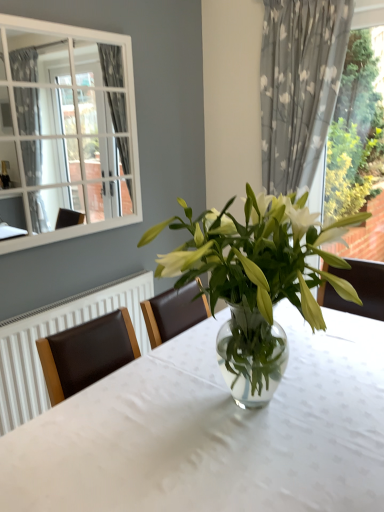
Locate an element on the screen. The image size is (384, 512). transparent glass vase at center is located at coordinates tap(214, 431).

The width and height of the screenshot is (384, 512). Describe the element at coordinates (299, 85) in the screenshot. I see `gray floral fabric curtain at right` at that location.

Locate an element on the screen. Image resolution: width=384 pixels, height=512 pixels. green leafy plant at right is located at coordinates (352, 128).

From the image's perspective, is green leafy plant at right above clear glass vase at center?

Yes.

Is green leafy plant at right oriented towards clear glass vase at center?

Yes, green leafy plant at right is aimed at clear glass vase at center.

Is green leafy plant at right smaller than clear glass vase at center?

Indeed, green leafy plant at right has a smaller size compared to clear glass vase at center.

Is green leafy plant at right positioned beyond the bounds of clear glass vase at center?

Yes, green leafy plant at right is not within clear glass vase at center.

Looking at the image, does clear glass vase at center seem bigger or smaller compared to gray floral fabric curtain at right?

Considering their sizes, clear glass vase at center takes up more space than gray floral fabric curtain at right.

From a real-world perspective, is clear glass vase at center above or below gray floral fabric curtain at right?

clear glass vase at center is situated lower than gray floral fabric curtain at right in the real world.

Image resolution: width=384 pixels, height=512 pixels. What are the coordinates of `table that appears below the gray floral fabric curtain at right (from a real-world perspective)` in the screenshot? It's located at (214, 431).

Is gray floral fabric curtain at right aimed at transparent glass vase at center?

Yes, gray floral fabric curtain at right faces towards transparent glass vase at center.

Would you say gray floral fabric curtain at right is outside transparent glass vase at center?

gray floral fabric curtain at right is positioned outside transparent glass vase at center.

Is green leafy plant at right directly adjacent to gray floral fabric curtain at right?

They are not placed beside each other.

Is green leafy plant at right looking in the opposite direction of gray floral fabric curtain at right?

green leafy plant at right does not have its back to gray floral fabric curtain at right.

Considering the positions of objects green leafy plant at right and gray floral fabric curtain at right in the image provided, who is more to the left, green leafy plant at right or gray floral fabric curtain at right?

gray floral fabric curtain at right.

Looking at this image, does gray floral fabric curtain at right have a greater width compared to green leafy plant at right?

Indeed, gray floral fabric curtain at right has a greater width compared to green leafy plant at right.

What's the angular difference between gray floral fabric curtain at right and green leafy plant at right's facing directions?

They differ by 0.00172 degrees in their facing directions.

The image size is (384, 512). Identify the location of curtain above the green leafy plant at right (from a real-world perspective). (299, 85).

Do you think gray floral fabric curtain at right is within green leafy plant at right, or outside of it?

gray floral fabric curtain at right cannot be found inside green leafy plant at right.

Would you say transparent glass vase at center is outside clear glass vase at center?

transparent glass vase at center lies outside clear glass vase at center's area.

Are transparent glass vase at center and clear glass vase at center making contact?

No, transparent glass vase at center is not next to clear glass vase at center.

Considering the positions of objects transparent glass vase at center and clear glass vase at center in the image provided, who is behind, transparent glass vase at center or clear glass vase at center?

clear glass vase at center is further away from the camera.

How different are the orientations of transparent glass vase at center and clear glass vase at center in degrees?

0.000242 degrees separate the facing orientations of transparent glass vase at center and clear glass vase at center.

Is green leafy plant at right with transparent glass vase at center?

There is a gap between green leafy plant at right and transparent glass vase at center.

Is point (326, 199) positioned in front of point (121, 485)?

No.

In terms of width, does green leafy plant at right look wider or thinner when compared to transparent glass vase at center?

Considering their sizes, green leafy plant at right looks slimmer than transparent glass vase at center.

Image resolution: width=384 pixels, height=512 pixels. Find the location of `houseplant in front of the green leafy plant at right`. houseplant in front of the green leafy plant at right is located at coordinates (256, 280).

Where is `houseplant beneath the gray floral fabric curtain at right (from a real-world perspective)`? The image size is (384, 512). houseplant beneath the gray floral fabric curtain at right (from a real-world perspective) is located at coordinates (256, 280).

When comparing their distances from clear glass vase at center, does green leafy plant at right or gray floral fabric curtain at right seem further?

green leafy plant at right is further to clear glass vase at center.

From the image, which object appears to be nearer to green leafy plant at right, gray floral fabric curtain at right or clear glass vase at center?

gray floral fabric curtain at right.

Which object lies nearer to the anchor point gray floral fabric curtain at right, green leafy plant at right or clear glass vase at center?

green leafy plant at right lies closer to gray floral fabric curtain at right than the other object.

Estimate the real-world distances between objects in this image. Which object is closer to transparent glass vase at center, clear glass vase at center or green leafy plant at right?

Based on the image, clear glass vase at center appears to be nearer to transparent glass vase at center.

When comparing their distances from green leafy plant at right, does clear glass vase at center or gray floral fabric curtain at right seem further?

clear glass vase at center.

From the image, which object appears to be farther from green leafy plant at right, clear glass vase at center or transparent glass vase at center?

Among the two, transparent glass vase at center is located further to green leafy plant at right.

Looking at the image, which one is located closer to green leafy plant at right, transparent glass vase at center or clear glass vase at center?

The object closer to green leafy plant at right is clear glass vase at center.

Considering their positions, is gray floral fabric curtain at right positioned closer to transparent glass vase at center than clear glass vase at center?

Among the two, clear glass vase at center is located nearer to transparent glass vase at center.

Where is `curtain between clear glass vase at center and green leafy plant at right along the z-axis`? curtain between clear glass vase at center and green leafy plant at right along the z-axis is located at coordinates (299, 85).

The image size is (384, 512). Find the location of `houseplant between transparent glass vase at center and gray floral fabric curtain at right along the z-axis`. houseplant between transparent glass vase at center and gray floral fabric curtain at right along the z-axis is located at coordinates click(256, 280).

At what (x,y) coordinates should I click in order to perform the action: click on houseplant between transparent glass vase at center and green leafy plant at right in the front-back direction. Please return your answer as a coordinate pair (x, y). Looking at the image, I should click on (256, 280).

Identify the location of curtain between transparent glass vase at center and green leafy plant at right along the z-axis. (299, 85).